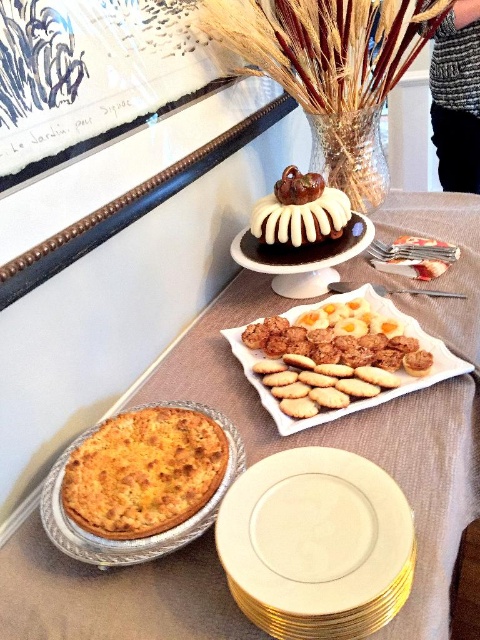
Question: Considering the relative positions of shiny aluminum pie tin at lower left and golden aluminum pie at lower left in the image provided, where is shiny aluminum pie tin at lower left located with respect to golden aluminum pie at lower left?

Choices:
 (A) above
 (B) below

Answer: (A)

Question: Which point is farther from the camera taking this photo?

Choices:
 (A) (289, 253)
 (B) (333, 435)

Answer: (A)

Question: Which of the following is the farthest from the observer?

Choices:
 (A) white porcelain plate at center
 (B) golden aluminum pie at lower left
 (C) white glazed cake at center
 (D) white porcelain cake at center

Answer: (C)

Question: Does shiny aluminum pie tin at lower left appear on the left side of white glazed cake at center?

Choices:
 (A) yes
 (B) no

Answer: (B)

Question: Considering the real-world distances, which object is closest to the white glazed cake at center?

Choices:
 (A) golden aluminum pie at lower left
 (B) white matte platter at center
 (C) white porcelain plate at center
 (D) white porcelain cake at center

Answer: (D)

Question: Is shiny aluminum pie tin at lower left further to camera compared to golden aluminum pie at lower left?

Choices:
 (A) no
 (B) yes

Answer: (A)